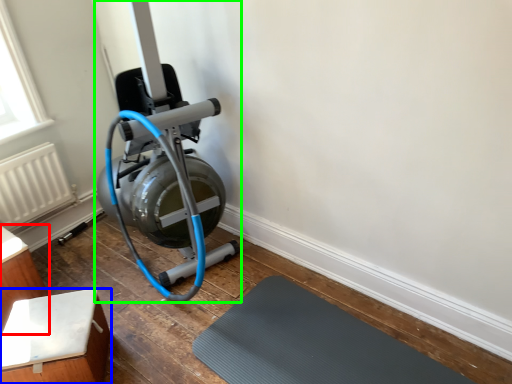
Question: Which object is positioned farthest from furniture (highlighted by a red box)? Select from furniture (highlighted by a blue box) and stationary bicycle (highlighted by a green box).

Choices:
 (A) furniture
 (B) stationary bicycle

Answer: (B)